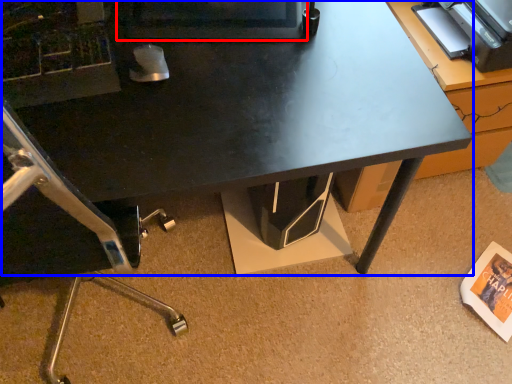
Question: Which object appears farthest to the camera in this image, computer monitor (highlighted by a red box) or desk (highlighted by a blue box)?

Choices:
 (A) computer monitor
 (B) desk

Answer: (A)